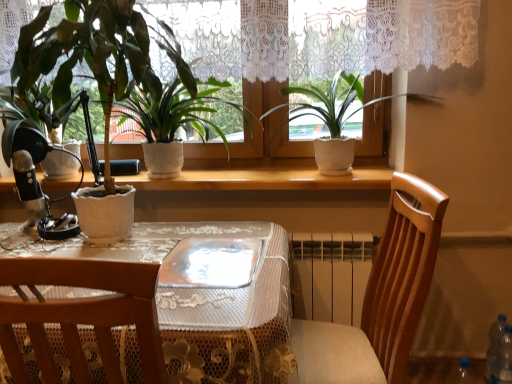
What is the approximate width of white textured pot at center, positioned as the 2th houseplant in left-to-right order?

It is 13.37 inches.

The width and height of the screenshot is (512, 384). What do you see at coordinates (169, 109) in the screenshot?
I see `white textured pot at center, which is counted as the 2th houseplant, starting from the right` at bounding box center [169, 109].

What do you see at coordinates (381, 297) in the screenshot?
I see `wooden chair at center` at bounding box center [381, 297].

This screenshot has width=512, height=384. Describe the element at coordinates (211, 263) in the screenshot. I see `transparent glass plate at center` at that location.

Locate an element on the screen. This screenshot has height=384, width=512. white textured pot at center, which is the third houseplant from left to right is located at coordinates (337, 121).

Is white textured pot at center, which is the third houseplant from left to right, completely or partially outside of transparent glass plate at center?

That's correct, white textured pot at center, which is the third houseplant from left to right, is outside of transparent glass plate at center.

From a real-world perspective, is white textured pot at center, placed as the 1th houseplant when sorted from right to left, physically located above or below transparent glass plate at center?

white textured pot at center, placed as the 1th houseplant when sorted from right to left, is situated higher than transparent glass plate at center in the real world.

Based on the photo, can you tell me how much white textured pot at center, placed as the 1th houseplant when sorted from right to left, and transparent glass plate at center differ in facing direction?

There is a 0.409-degree angle between the facing directions of white textured pot at center, placed as the 1th houseplant when sorted from right to left, and transparent glass plate at center.

Between white textured pot at center, which is the third houseplant from left to right, and transparent glass plate at center, which one appears on the right side from the viewer's perspective?

Positioned to the right is white textured pot at center, which is the third houseplant from left to right.

Looking at this image, is wooden chair at center a part of white textured pot at center, placed as the 1th houseplant when sorted from right to left?

Definitely not — wooden chair at center is not inside white textured pot at center, placed as the 1th houseplant when sorted from right to left.

Consider the image. Does white textured pot at center, which is the third houseplant from left to right, touch wooden chair at center?

No, white textured pot at center, which is the third houseplant from left to right, is not making contact with wooden chair at center.

Based on their sizes in the image, would you say white textured pot at center, which is the third houseplant from left to right, is bigger or smaller than wooden chair at center?

Considering their sizes, white textured pot at center, which is the third houseplant from left to right, takes up less space than wooden chair at center.

Is point (221, 233) behind point (496, 331)?

No.

Can you confirm if wooden table at center is bigger than transparent plastic bottle at lower right?

Yes.

Is wooden table at center in contact with transparent plastic bottle at lower right?

No, wooden table at center is not in contact with transparent plastic bottle at lower right.

Looking at this image, from the image's perspective, which is below, wooden table at center or transparent plastic bottle at lower right?

transparent plastic bottle at lower right, from the image's perspective.

Who is shorter, wooden table at center or wooden at upper center?

wooden at upper center.

Would you say wooden table at center contains wooden at upper center?

No, wooden at upper center is not surrounded by wooden table at center.

Which is in front, wooden table at center or wooden at upper center?

wooden table at center.

From the image's perspective, which is below, wooden table at center or wooden at upper center?

wooden table at center appears lower in the image.

Looking at this image, which point is more forward, (362, 109) or (494, 344)?

The point (494, 344) is closer.

Between white textured pot at center, placed as the 1th houseplant when sorted from right to left, and transparent plastic bottle at lower right, which one is positioned behind?

transparent plastic bottle at lower right is behind.

Considering the sizes of objects white textured pot at center, placed as the 1th houseplant when sorted from right to left, and transparent plastic bottle at lower right in the image provided, who is wider, white textured pot at center, placed as the 1th houseplant when sorted from right to left, or transparent plastic bottle at lower right?

Wider between the two is white textured pot at center, placed as the 1th houseplant when sorted from right to left.

Is white textured pot at center, which is the third houseplant from left to right, bigger than transparent plastic bottle at lower right?

Correct, white textured pot at center, which is the third houseplant from left to right, is larger in size than transparent plastic bottle at lower right.

Considering the relative positions of wooden at upper center and wooden table at center in the image provided, is wooden at upper center to the left of wooden table at center from the viewer's perspective?

No, wooden at upper center is not to the left of wooden table at center.

Is wooden at upper center not inside wooden table at center?

Indeed, wooden at upper center is completely outside wooden table at center.

Looking at this image, which object is closer to the camera, wooden at upper center or wooden table at center?

wooden table at center is closer to the camera.

Is transparent glass plate at center oriented away from white textured pot at center, which is counted as the 2th houseplant, starting from the right?

That's not correct — transparent glass plate at center is not looking away from white textured pot at center, which is counted as the 2th houseplant, starting from the right.

From the image's perspective, is transparent glass plate at center below white textured pot at center, which is counted as the 2th houseplant, starting from the right?

Yes, from the image's perspective, transparent glass plate at center is beneath white textured pot at center, which is counted as the 2th houseplant, starting from the right.

Considering the relative sizes of transparent glass plate at center and white textured pot at center, positioned as the 2th houseplant in left-to-right order, in the image provided, is transparent glass plate at center bigger than white textured pot at center, positioned as the 2th houseplant in left-to-right order,?

Incorrect, transparent glass plate at center is not larger than white textured pot at center, positioned as the 2th houseplant in left-to-right order.

At what (x,y) coordinates should I click in order to perform the action: click on glass plate below the white textured pot at center, placed as the 1th houseplant when sorted from right to left (from a real-world perspective). Please return your answer as a coordinate pair (x, y). This screenshot has width=512, height=384. Looking at the image, I should click on (211, 263).

Image resolution: width=512 pixels, height=384 pixels. I want to click on chair below the white textured pot at center, placed as the 1th houseplant when sorted from right to left (from the image's perspective), so click(381, 297).

Looking at the image, which one is located further to white textured pot at center, which is counted as the 2th houseplant, starting from the right, wooden table at center or transparent glass plate at center?

transparent glass plate at center lies further to white textured pot at center, which is counted as the 2th houseplant, starting from the right, than the other object.

Which object lies further to the anchor point wooden table at center, wooden chair at center or wooden at upper center?

wooden at upper center.

Based on their spatial positions, is transparent plastic bottle at lower right or white textured pot at center, which is the third houseplant from left to right, further from wooden table at center?

transparent plastic bottle at lower right is further to wooden table at center.

From the image, which object appears to be farther from wooden at upper center, wooden table at center or white textured pot at center, which is counted as the 2th houseplant, starting from the right?

Among the two, wooden table at center is located further to wooden at upper center.

Considering their positions, is transparent plastic bottle at lower right positioned further to wooden chair at center than white textured pot at center, positioned as the 2th houseplant in left-to-right order?

transparent plastic bottle at lower right.

Looking at the image, which one is located further to white textured pot at center, which is the third houseplant from left to right, wooden at upper center or wooden table at center?

wooden table at center is further to white textured pot at center, which is the third houseplant from left to right.

From the image, which object appears to be farther from wooden table at center, transparent plastic bottle at lower right or matte white pot at left, the 1th houseplant in the left-to-right sequence?

transparent plastic bottle at lower right is further to wooden table at center.

Based on their spatial positions, is wooden chair at center or wooden table at center further from wooden at upper center?

Based on the image, wooden table at center appears to be further to wooden at upper center.

What are the coordinates of `glass plate between matte white pot at left, the 1th houseplant in the left-to-right sequence, and wooden chair at center from left to right` in the screenshot? It's located at (211, 263).

Image resolution: width=512 pixels, height=384 pixels. In order to click on glass plate between wooden table at center and wooden at upper center from front to back in this screenshot , I will do `click(211, 263)`.

The image size is (512, 384). I want to click on chair located between white textured pot at center, which is counted as the 2th houseplant, starting from the right, and white textured pot at center, placed as the 1th houseplant when sorted from right to left, in the left-right direction, so click(381, 297).

Where is `glass plate between white textured pot at center, placed as the 1th houseplant when sorted from right to left, and wooden chair at center from top to bottom`? The height and width of the screenshot is (384, 512). glass plate between white textured pot at center, placed as the 1th houseplant when sorted from right to left, and wooden chair at center from top to bottom is located at coordinates (211, 263).